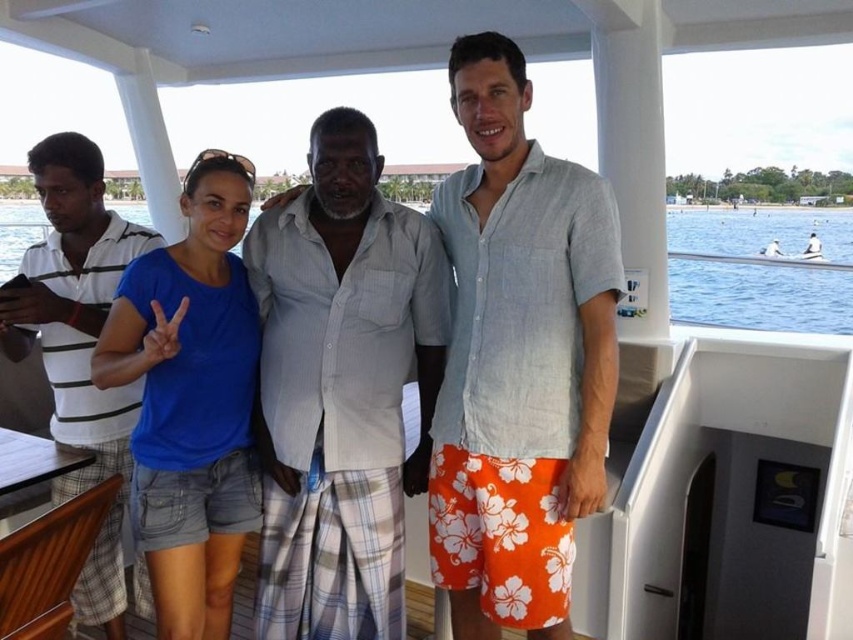
Question: Which object is the closest to the light gray striped shirt at center?

Choices:
 (A) blue water at center
 (B) orange floral shorts at center
 (C) light blue linen shirt at center

Answer: (C)

Question: Is white striped polo shirt at left bigger than orange floral shorts at center?

Choices:
 (A) yes
 (B) no

Answer: (A)

Question: Can you confirm if light gray striped shirt at center is thinner than white striped polo shirt at left?

Choices:
 (A) yes
 (B) no

Answer: (B)

Question: Among these points, which one is farthest from the camera?

Choices:
 (A) tap(781, 221)
 (B) tap(403, 474)
 (C) tap(172, 589)
 (D) tap(71, 396)

Answer: (A)

Question: Among these objects, which one is farthest from the camera?

Choices:
 (A) light blue linen shirt at center
 (B) light gray striped shirt at center
 (C) orange floral shorts at center
 (D) blue water at center

Answer: (C)

Question: Can you confirm if blue cotton shirt at center is bigger than white striped polo shirt at left?

Choices:
 (A) no
 (B) yes

Answer: (A)